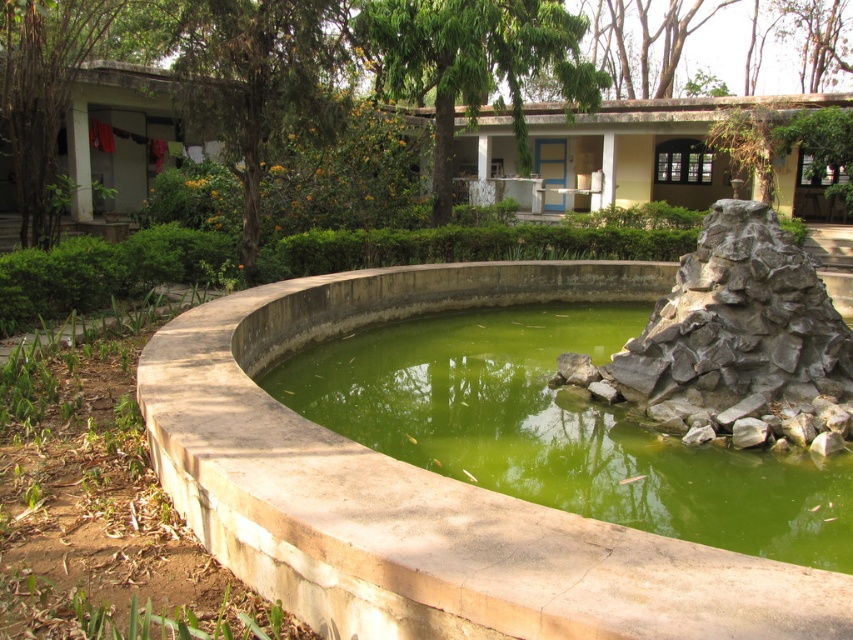
In the scene shown: Does green concrete pond at center have a smaller size compared to gray rock formation at right?

Indeed, green concrete pond at center has a smaller size compared to gray rock formation at right.

Between point (584, 458) and point (776, 246), which one is positioned in front?

Point (584, 458) is in front.

Image resolution: width=853 pixels, height=640 pixels. I want to click on green concrete pond at center, so click(x=558, y=432).